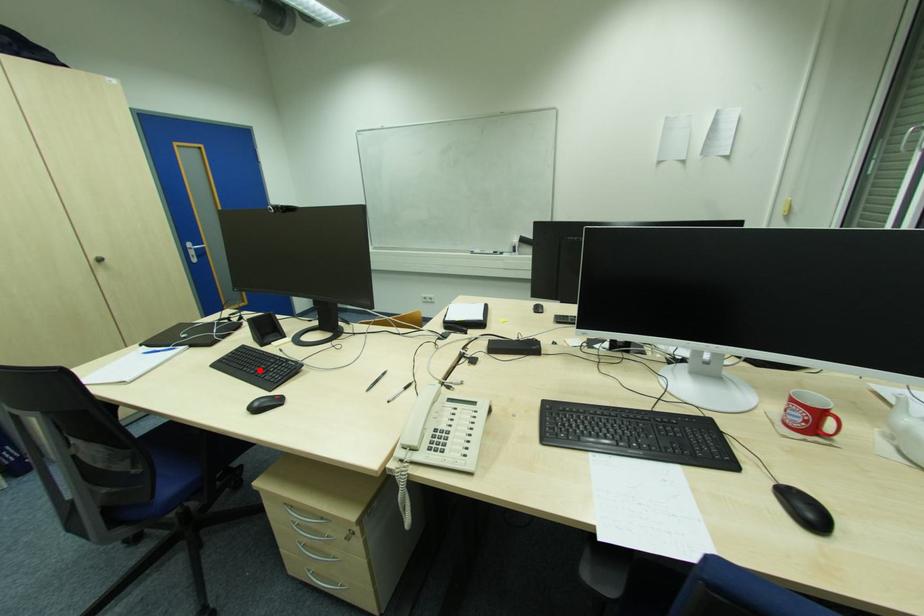
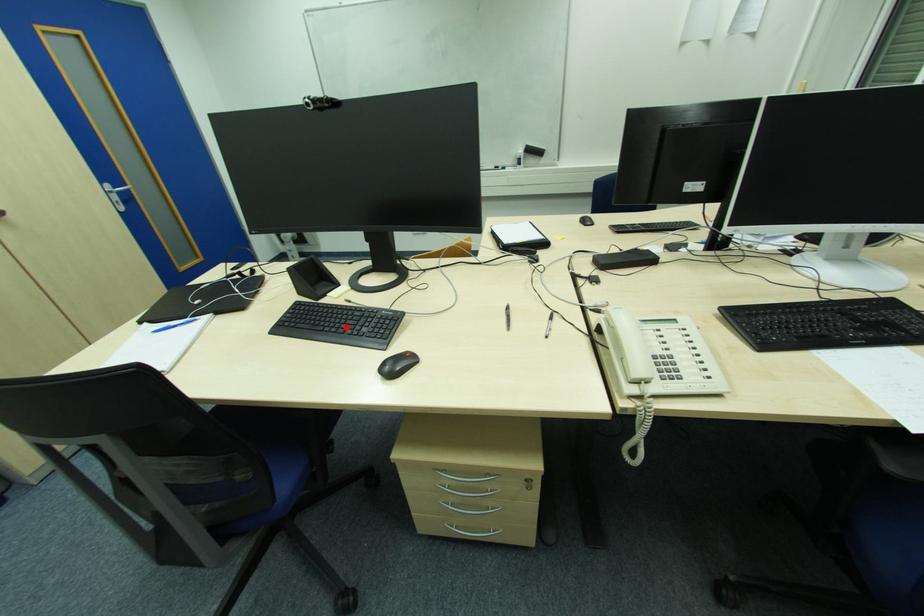
I am providing you with two images of the same scene from different viewpoints. A red point is marked on the first image and another point is marked on the second image. Are the points marked in image1 and image2 representing the same 3D position?

Yes